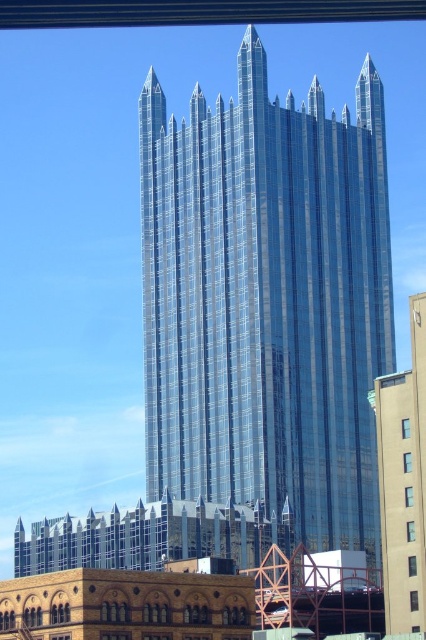
You are an architect evaluating the two glass structures in the scene. Which one is taller between the transparent glass tower at center and the shiny glass skyscraper at center?

The transparent glass tower at center is much taller than the shiny glass skyscraper at center.

You are an architect evaluating the layout of the city skyline. You notice the transparent glass tower at center and the shiny glass skyscraper at center. Which one is located to the left of the other?

The transparent glass tower at center is positioned on the left side of the shiny glass skyscraper at center.

You are standing in front of two glass buildings. You see the transparent glass tower at center and the shiny glass skyscraper at center. Which one is closer to you?

The transparent glass tower at center is closer to you because it is further to the viewer than the shiny glass skyscraper at center.